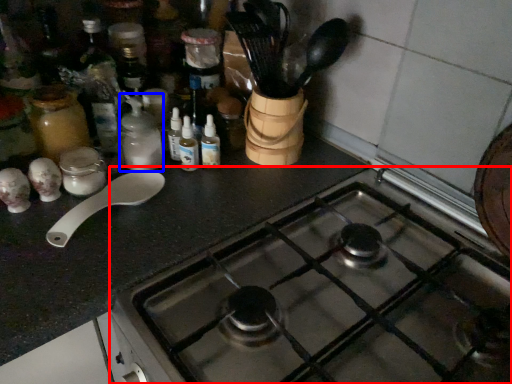
Question: Which of the following is the closest to the observer, gas stove (highlighted by a red box) or bottle (highlighted by a blue box)?

Choices:
 (A) gas stove
 (B) bottle

Answer: (A)